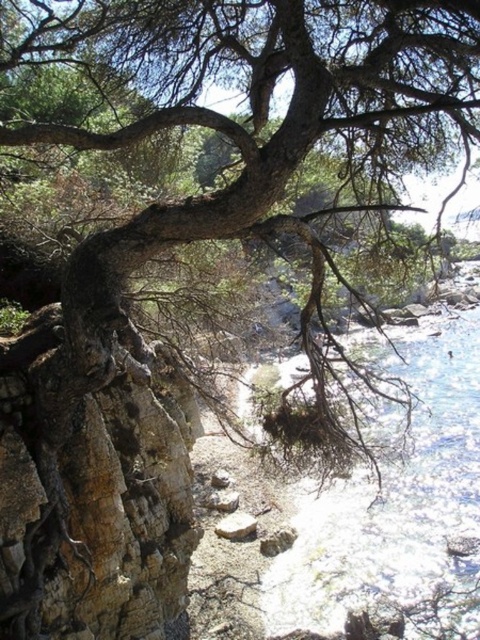
Can you confirm if clear blue water at lower right is positioned above gray rough stone at center?

Indeed, clear blue water at lower right is positioned over gray rough stone at center.

Does clear blue water at lower right have a greater height compared to gray rough stone at center?

Indeed, clear blue water at lower right has a greater height compared to gray rough stone at center.

Between point (411, 580) and point (250, 518), which one is positioned behind?

The point (250, 518) is behind.

Where is `clear blue water at lower right`? clear blue water at lower right is located at coordinates (396, 497).